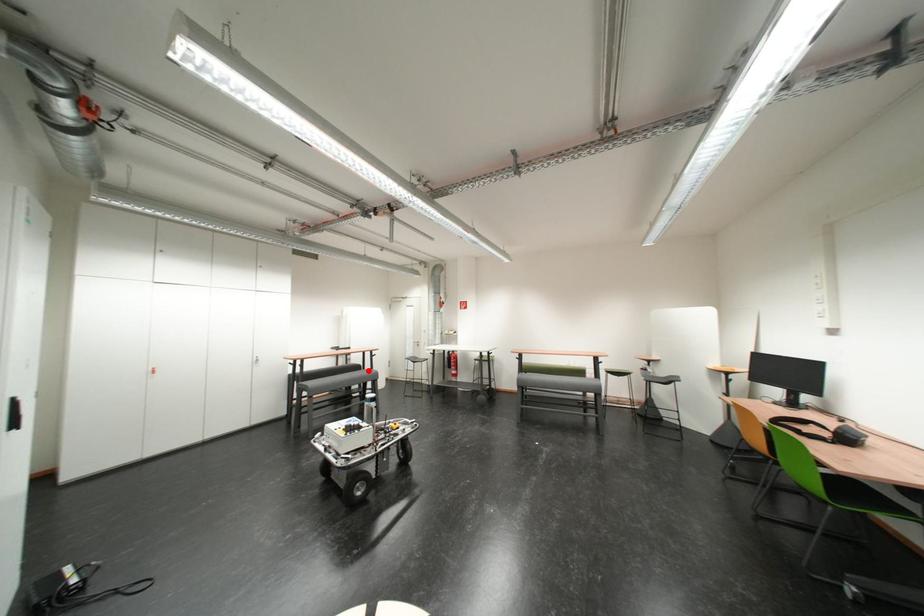
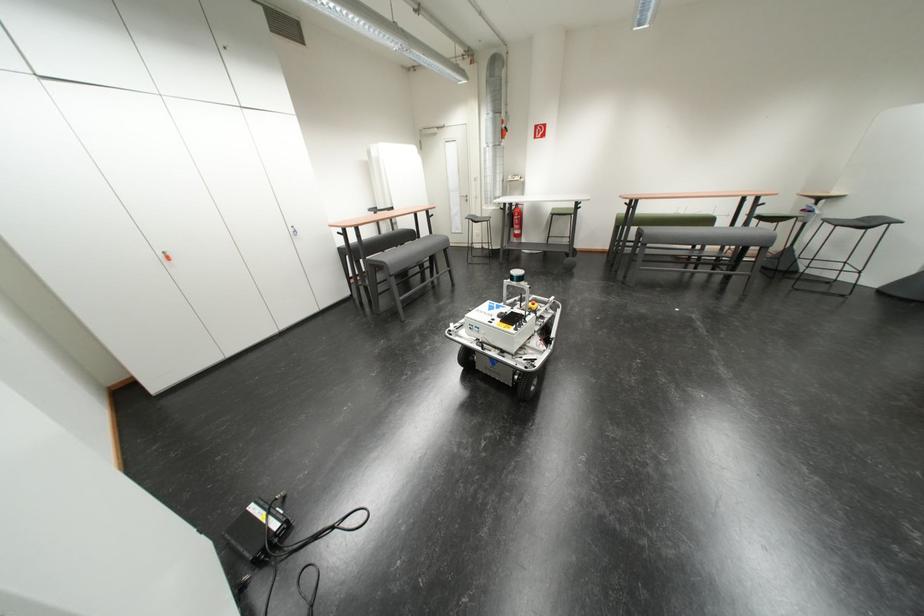
Question: I am providing you with two images of the same scene from different viewpoints. Image1 has a red point marked. In image2, the corresponding 3D location appears at what relative position? Reply with the corresponding letter.

Choices:
 (A) Closer
 (B) Farther

Answer: (B)